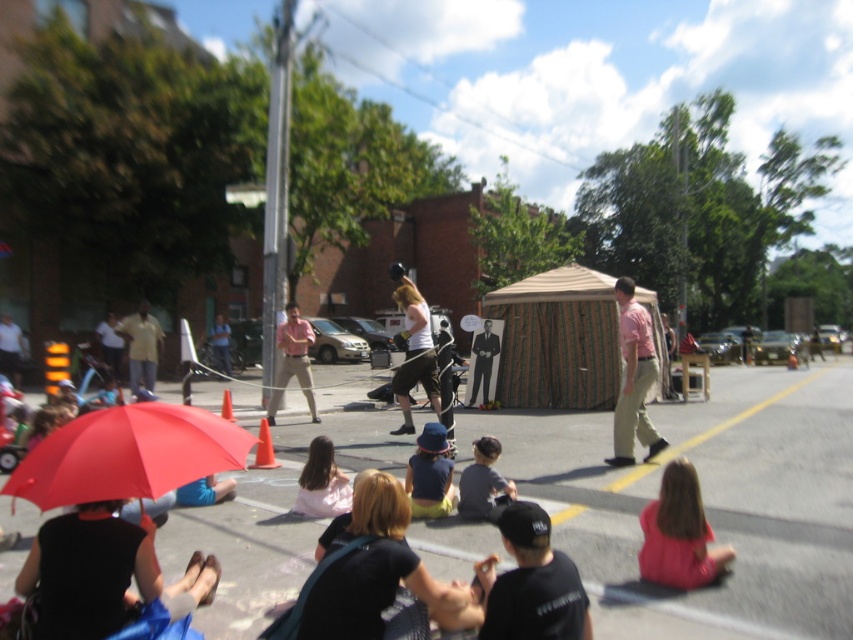
Question: Which point appears farthest from the camera in this image?

Choices:
 (A) (190, 476)
 (B) (492, 397)
 (C) (231, 420)
 (D) (428, 401)

Answer: (B)

Question: Is pink cotton shirt at center wider than orange plastic cone at center?

Choices:
 (A) yes
 (B) no

Answer: (B)

Question: Does matte pink shirt at center have a greater width compared to orange plastic cone at center?

Choices:
 (A) no
 (B) yes

Answer: (B)

Question: Can you confirm if black suit at center is thinner than orange cone at center?

Choices:
 (A) yes
 (B) no

Answer: (A)

Question: Which object is closer to the camera taking this photo?

Choices:
 (A) orange traffic cone at center
 (B) pink cotton shirt at center
 (C) white tank top at center

Answer: (B)

Question: Which of the following is the closest to the observer?

Choices:
 (A) black suit at center
 (B) matte red umbrella at lower left

Answer: (B)